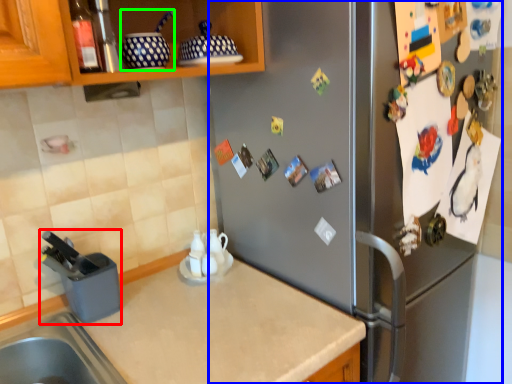
Question: Considering the real-world distances, which object is closest to appliance (highlighted by a red box)? fridge (highlighted by a blue box) or appliance (highlighted by a green box).

Choices:
 (A) fridge
 (B) appliance

Answer: (B)